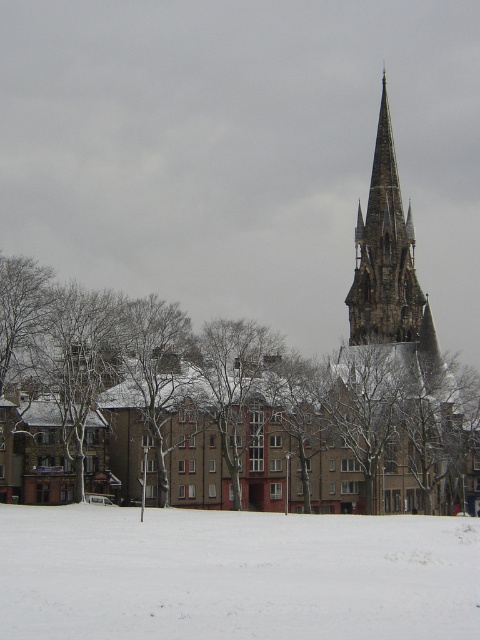
Question: Can you confirm if snow-covered tree at lower left is positioned below white powdery snow at lower center?

Choices:
 (A) yes
 (B) no

Answer: (B)

Question: Is snow-covered tree at lower left positioned in front of white powdery snow at lower center?

Choices:
 (A) no
 (B) yes

Answer: (A)

Question: Estimate the real-world distances between objects in this image. Which object is farther from the snow-covered tree at lower left?

Choices:
 (A) dark gray stone spire at upper center
 (B) white powdery snow at lower center

Answer: (B)

Question: Which point is closer to the camera?

Choices:
 (A) snow-covered tree at lower left
 (B) dark gray stone spire at upper center

Answer: (A)

Question: Is snow-covered tree at lower left positioned behind dark gray stone spire at upper center?

Choices:
 (A) yes
 (B) no

Answer: (B)

Question: Which point is farther to the camera?

Choices:
 (A) white powdery snow at lower center
 (B) dark gray stone spire at upper center
 (C) snow-covered tree at lower left

Answer: (B)